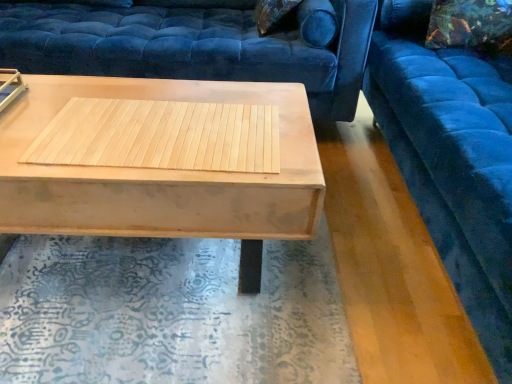
Question: Is light wood/texture coffee table at center taller or shorter than velvet blue studio couch at upper right, the 2th studio couch in the left-to-right sequence?

Choices:
 (A) tall
 (B) short

Answer: (B)

Question: Is light wood/texture coffee table at center spatially inside velvet blue studio couch at upper right, which is the first studio couch from right to left, or outside of it?

Choices:
 (A) outside
 (B) inside

Answer: (A)

Question: Considering the real-world distances, which object is closest to the natural wood mat at center?

Choices:
 (A) velvet blue studio couch at upper center, placed as the second studio couch when sorted from right to left
 (B) velvet floral pillow at upper right
 (C) velvet blue studio couch at upper right, the 2th studio couch in the left-to-right sequence
 (D) light wood/texture coffee table at center

Answer: (D)

Question: Which of these objects is positioned closest to the velvet blue studio couch at upper right, the 2th studio couch in the left-to-right sequence?

Choices:
 (A) light wood/texture coffee table at center
 (B) natural wood mat at center
 (C) velvet blue studio couch at upper center, placed as the second studio couch when sorted from right to left
 (D) velvet floral pillow at upper right

Answer: (D)